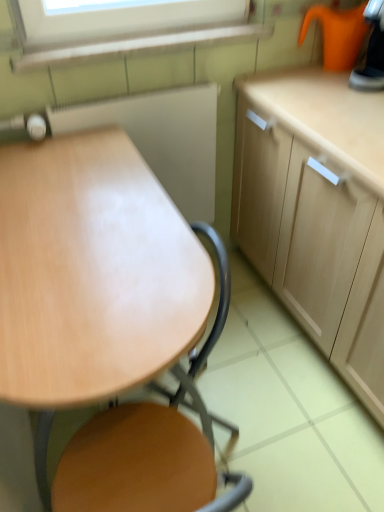
Question: Considering the relative sizes of orange plastic kettle at upper right, the first appliance positioned from the right, and wooden at center in the image provided, is orange plastic kettle at upper right, the first appliance positioned from the right, wider than wooden at center?

Choices:
 (A) yes
 (B) no

Answer: (B)

Question: Is orange plastic kettle at upper right, the first appliance positioned from the right, facing towards wooden at center?

Choices:
 (A) no
 (B) yes

Answer: (A)

Question: Considering the relative sizes of orange plastic kettle at upper right, the second appliance in the bottom-to-top sequence, and wooden at center in the image provided, is orange plastic kettle at upper right, the second appliance in the bottom-to-top sequence, shorter than wooden at center?

Choices:
 (A) yes
 (B) no

Answer: (A)

Question: From the image's perspective, is orange plastic kettle at upper right, the 2th appliance from the left, over wooden at center?

Choices:
 (A) no
 (B) yes

Answer: (B)

Question: Does orange plastic kettle at upper right, the first appliance positioned from the right, have a smaller size compared to wooden at center?

Choices:
 (A) yes
 (B) no

Answer: (A)

Question: Can you confirm if orange plastic kettle at upper right, the second appliance in the bottom-to-top sequence, is positioned to the right of wooden at center?

Choices:
 (A) yes
 (B) no

Answer: (A)

Question: Can wooden table at center be found inside wooden board at center, which ranks as the 1th appliance in bottom-to-top order?

Choices:
 (A) yes
 (B) no

Answer: (B)

Question: Can you confirm if wooden board at center, the 1th appliance from the left, is bigger than wooden table at center?

Choices:
 (A) no
 (B) yes

Answer: (A)

Question: Is wooden board at center, which ranks as the 1th appliance in bottom-to-top order, oriented away from wooden table at center?

Choices:
 (A) yes
 (B) no

Answer: (B)

Question: From a real-world perspective, is wooden board at center, the 2th appliance when ordered from top to bottom, physically below wooden table at center?

Choices:
 (A) no
 (B) yes

Answer: (A)

Question: Is wooden board at center, the 2th appliance when ordered from top to bottom, taller than wooden table at center?

Choices:
 (A) no
 (B) yes

Answer: (A)

Question: Is the position of wooden board at center, the 1th appliance from the left, less distant than that of wooden table at center?

Choices:
 (A) no
 (B) yes

Answer: (A)

Question: Is wooden board at center, the 1th appliance from the left, at the back of orange plastic kettle at upper right, the 2th appliance from the left?

Choices:
 (A) yes
 (B) no

Answer: (B)